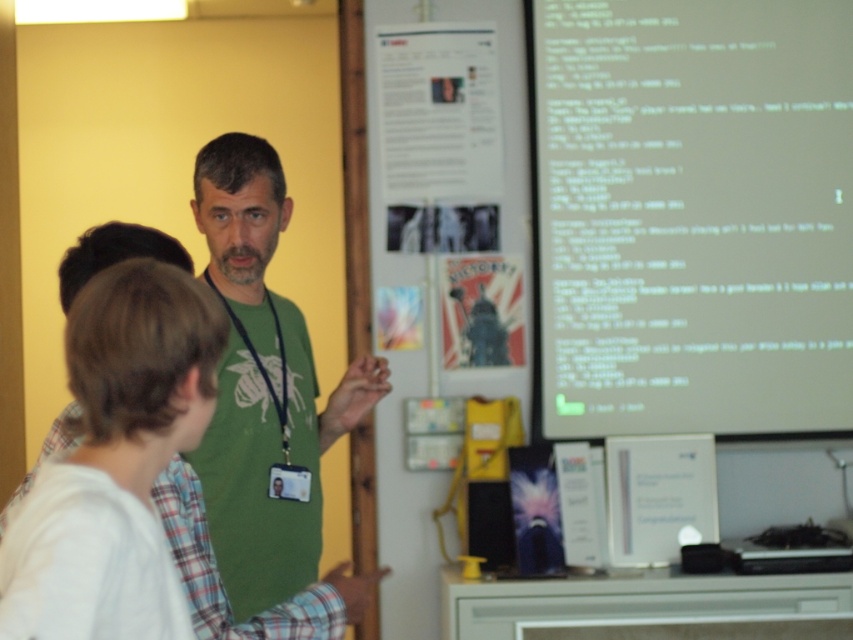
Which of these two, green text on white paper at upper right or matte paper poster at center, stands taller?

green text on white paper at upper right is taller.

Which is behind, point (688, 74) or point (479, 301)?

The point (479, 301) is more distant.

The image size is (853, 640). In order to click on green text on white paper at upper right in this screenshot , I will do `click(694, 216)`.

Which is more to the left, green matte shirt at center or matte paper poster at center?

Positioned to the left is green matte shirt at center.

Does point (244, 323) come closer to viewer compared to point (503, 314)?

Yes, point (244, 323) is closer to viewer.

Between point (228, 518) and point (469, 364), which one is positioned behind?

The point (469, 364) is behind.

You are a GUI agent. You are given a task and a screenshot of the screen. Output one action in this format:
    pyautogui.click(x=<x>, y=<y>)
    Task: Click on the green matte shirt at center
    
    Given the screenshot: What is the action you would take?
    pyautogui.click(x=263, y=387)

Who is higher up, green text on white paper at upper right or green matte shirt at center?

green text on white paper at upper right is above.

Can you confirm if green text on white paper at upper right is positioned to the left of green matte shirt at center?

Incorrect, green text on white paper at upper right is not on the left side of green matte shirt at center.

You are a GUI agent. You are given a task and a screenshot of the screen. Output one action in this format:
    pyautogui.click(x=<x>, y=<y>)
    Task: Click on the green text on white paper at upper right
    The width and height of the screenshot is (853, 640).
    Given the screenshot: What is the action you would take?
    pyautogui.click(x=694, y=216)

You are a GUI agent. You are given a task and a screenshot of the screen. Output one action in this format:
    pyautogui.click(x=<x>, y=<y>)
    Task: Click on the green text on white paper at upper right
    The width and height of the screenshot is (853, 640).
    Given the screenshot: What is the action you would take?
    pyautogui.click(x=694, y=216)